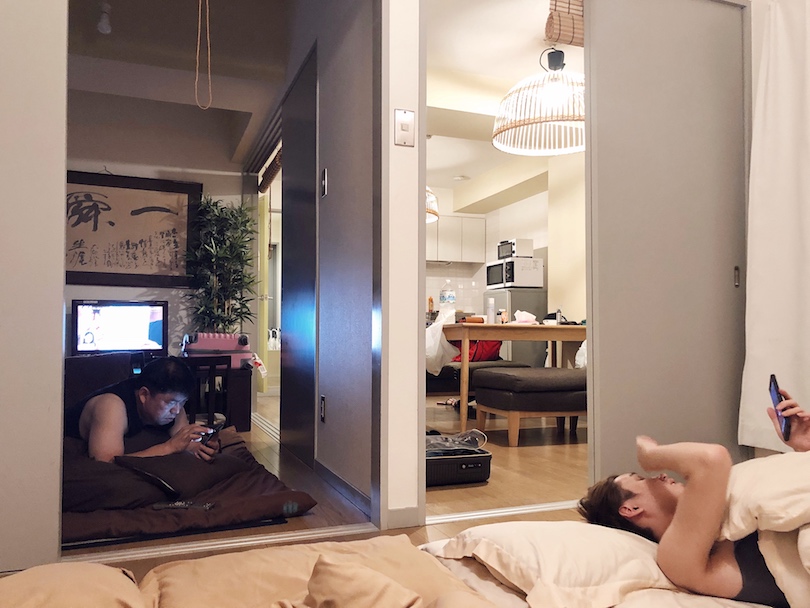
The height and width of the screenshot is (608, 810). Find the location of `kitchen appliances`. kitchen appliances is located at coordinates (497, 278), (509, 244), (513, 298).